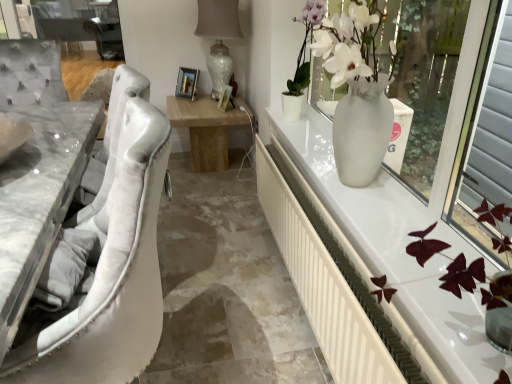
What is the approximate width of white glossy vase at right?

It is 36.45 centimeters.

Identify the location of white marble table at left. (40, 190).

Image resolution: width=512 pixels, height=384 pixels. In order to click on white glossy vase at upper right in this screenshot , I will do `click(349, 42)`.

In terms of height, does white glossy vase at upper right look taller or shorter compared to white plastic radiator at right?

In the image, white glossy vase at upper right appears to be taller than white plastic radiator at right.

From the picture: Which object is further away from the camera taking this photo, white glossy vase at upper right or white plastic radiator at right?

white glossy vase at upper right is further from the camera.

From the image's perspective, who appears lower, white glossy vase at upper right or white plastic radiator at right?

white plastic radiator at right.

Considering the sizes of white glossy vase at upper right and white plastic radiator at right in the image, is white glossy vase at upper right wider or thinner than white plastic radiator at right?

In the image, white glossy vase at upper right appears to be wider than white plastic radiator at right.

From the image's perspective, between white plastic radiator at right and white glossy vase at right, which one is located above?

From the image's view, white glossy vase at right is above.

Considering the relative positions of white plastic radiator at right and white glossy vase at right in the image provided, is white plastic radiator at right to the left of white glossy vase at right from the viewer's perspective?

Yes.

Is white plastic radiator at right positioned in front of white glossy vase at right?

Yes, white plastic radiator at right is closer to the viewer.

Can you confirm if white plastic radiator at right is thinner than white glossy vase at right?

Correct, the width of white plastic radiator at right is less than that of white glossy vase at right.

Would you say white glossy vase at right is to the left or to the right of white plastic radiator at right in the picture?

white glossy vase at right is positioned on white plastic radiator at right's right side.

Is white glossy vase at right situated inside white plastic radiator at right or outside?

The correct answer is: outside.

Is white glossy vase at right bigger than white plastic radiator at right?

Indeed, white glossy vase at right has a larger size compared to white plastic radiator at right.

From the image's perspective, is white glossy vase at right over white plastic radiator at right?

Yes, from the image's perspective, white glossy vase at right is on top of white plastic radiator at right.

Would you say white plastic radiator at right is inside or outside white marble table at left?

white plastic radiator at right is not inside white marble table at left, it's outside.

Would you say white plastic radiator at right is a long distance from white marble table at left?

No.

Where is `radiator behind the white marble table at left`? The image size is (512, 384). radiator behind the white marble table at left is located at coordinates (335, 283).

Does white plastic radiator at right turn towards white marble table at left?

No.

From the picture: Between white marble table at left and white glossy vase at upper right, which one has less height?

white marble table at left is shorter.

Between white marble table at left and white glossy vase at upper right, which one appears on the left side from the viewer's perspective?

From the viewer's perspective, white marble table at left appears more on the left side.

Does white marble table at left turn towards white glossy vase at upper right?

No, white marble table at left is not facing towards white glossy vase at upper right.

Considering the relative sizes of white marble table at left and white glossy vase at upper right in the image provided, is white marble table at left bigger than white glossy vase at upper right?

No.

Considering the positions of point (440, 31) and point (355, 71), is point (440, 31) closer or farther from the camera than point (355, 71)?

Clearly, point (440, 31) is more distant from the camera than point (355, 71).

Looking at this image, how different are the orientations of white glossy vase at right and white glossy vase at upper right in degrees?

The facing directions of white glossy vase at right and white glossy vase at upper right are 0.00106 degrees apart.

In the scene shown: From a real-world perspective, who is located lower, white glossy vase at right or white glossy vase at upper right?

white glossy vase at upper right is physically lower.

Are white glossy vase at right and white marble table at left making contact?

No, white glossy vase at right is not with white marble table at left.

From the image's perspective, who appears lower, white glossy vase at right or white marble table at left?

white marble table at left, from the image's perspective.

Can you confirm if white glossy vase at right is bigger than white marble table at left?

Yes.

Is white glossy vase at right in front of or behind white marble table at left in the image?

Clearly, white glossy vase at right is behind white marble table at left.

The image size is (512, 384). I want to click on radiator below the white glossy vase at upper right (from the image's perspective), so click(335, 283).

Find the location of a particular element. This screenshot has width=512, height=384. radiator in front of the white glossy vase at right is located at coordinates 335,283.

In the scene shown: Looking at the image, which one is located closer to white glossy vase at right, white plastic radiator at right or white glossy vase at upper right?

Among the two, white glossy vase at upper right is located nearer to white glossy vase at right.

When comparing their distances from white marble table at left, does white glossy vase at upper right or white glossy vase at right seem further?

white glossy vase at right is further to white marble table at left.

When comparing their distances from white marble table at left, does white plastic radiator at right or white glossy vase at upper right seem further?

white glossy vase at upper right lies further to white marble table at left than the other object.

Which object lies further to the anchor point white plastic radiator at right, white marble table at left or white glossy vase at upper right?

white marble table at left is positioned further to the anchor white plastic radiator at right.

Estimate the real-world distances between objects in this image. Which object is further from white marble table at left, white plastic radiator at right or white glossy vase at right?

white glossy vase at right is further to white marble table at left.

Considering their positions, is white glossy vase at upper right positioned further to white glossy vase at right than white plastic radiator at right?

white plastic radiator at right is further to white glossy vase at right.

Looking at the image, which one is located further to white glossy vase at right, white plastic radiator at right or white marble table at left?

white marble table at left.

Which object lies further to the anchor point white glossy vase at upper right, white marble table at left or white plastic radiator at right?

white marble table at left.

This screenshot has height=384, width=512. Find the location of `floral arrangement between white marble table at left and white glossy vase at right from left to right`. floral arrangement between white marble table at left and white glossy vase at right from left to right is located at coordinates (349, 42).

This screenshot has height=384, width=512. In order to click on radiator between white marble table at left and white glossy vase at upper right from left to right in this screenshot , I will do `click(335, 283)`.

Locate an element on the screen. This screenshot has width=512, height=384. window screen between white plastic radiator at right and white glossy vase at upper right in the front-back direction is located at coordinates (418, 79).

What are the coordinates of `radiator situated between white marble table at left and white glossy vase at right from left to right` in the screenshot? It's located at (335, 283).